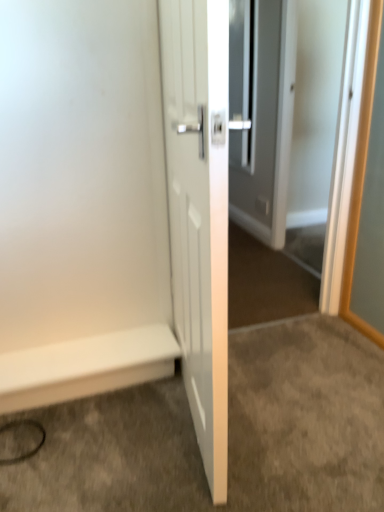
Question: From a real-world perspective, is white glossy door at center physically located above or below white smooth baseboard at lower left?

Choices:
 (A) below
 (B) above

Answer: (B)

Question: Is white glossy door at center inside the boundaries of white smooth baseboard at lower left, or outside?

Choices:
 (A) inside
 (B) outside

Answer: (B)

Question: Estimate the real-world distances between objects in this image. Which object is closer to the white glossy door at center?

Choices:
 (A) white glossy door at center
 (B) white smooth baseboard at lower left

Answer: (B)

Question: Estimate the real-world distances between objects in this image. Which object is closer to the white smooth baseboard at lower left?

Choices:
 (A) white glossy door at center
 (B) white glossy door at center

Answer: (A)